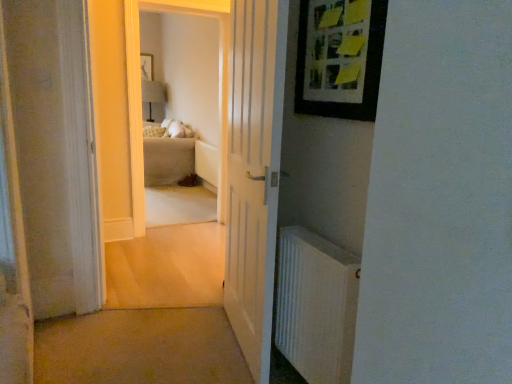
Question: Should I look upward or downward to see wooden picture frame at upper right, the 2th picture frame from the top?

Choices:
 (A) up
 (B) down

Answer: (A)

Question: Is carpet at center not inside white wooden door at center?

Choices:
 (A) no
 (B) yes

Answer: (B)

Question: From the image's perspective, would you say carpet at center is shown under white wooden door at center?

Choices:
 (A) no
 (B) yes

Answer: (B)

Question: Are carpet at center and white wooden door at center located far from each other?

Choices:
 (A) no
 (B) yes

Answer: (A)

Question: Could you tell me if carpet at center is facing white wooden door at center?

Choices:
 (A) yes
 (B) no

Answer: (B)

Question: Are carpet at center and white wooden door at center beside each other?

Choices:
 (A) yes
 (B) no

Answer: (B)

Question: Considering the relative sizes of carpet at center and white wooden door at center in the image provided, is carpet at center shorter than white wooden door at center?

Choices:
 (A) no
 (B) yes

Answer: (B)

Question: From a real-world perspective, is matte white lampshade at upper center located beneath beige fabric couch at center?

Choices:
 (A) no
 (B) yes

Answer: (A)

Question: Is matte white lampshade at upper center aimed at beige fabric couch at center?

Choices:
 (A) yes
 (B) no

Answer: (A)

Question: Is matte white lampshade at upper center looking in the opposite direction of beige fabric couch at center?

Choices:
 (A) yes
 (B) no

Answer: (B)

Question: From a real-world perspective, is matte white lampshade at upper center physically above beige fabric couch at center?

Choices:
 (A) no
 (B) yes

Answer: (B)

Question: Does matte white lampshade at upper center have a lesser width compared to beige fabric couch at center?

Choices:
 (A) yes
 (B) no

Answer: (A)

Question: Is the depth of matte white lampshade at upper center less than that of beige fabric couch at center?

Choices:
 (A) yes
 (B) no

Answer: (B)

Question: Does carpet at center appear on the right side of matte black picture frame at upper center, which appears as the 1th picture frame when viewed from the back?

Choices:
 (A) no
 (B) yes

Answer: (B)